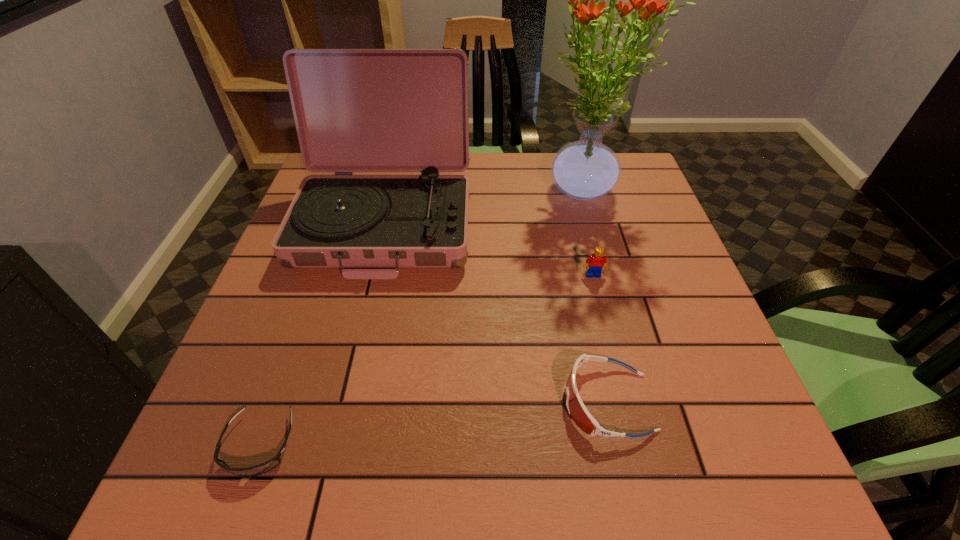
The height and width of the screenshot is (540, 960). In order to click on flower arrangement in this screenshot , I will do `click(584, 170)`.

Locate an element on the screen. record player is located at coordinates (356, 110).

In order to click on Lego in this screenshot , I will do `click(597, 261)`.

At what (x,y) coordinates should I click in order to perform the action: click on the second shortest object. Please return your answer as a coordinate pair (x, y). This screenshot has height=540, width=960. Looking at the image, I should click on (576, 408).

The height and width of the screenshot is (540, 960). Identify the location of the taller goggles. (576, 408).

What are the coordinates of `the shortest object` in the screenshot? It's located at (262, 468).

Locate an element on the screen. the left goggles is located at coordinates (262, 468).

This screenshot has height=540, width=960. In order to click on vacant space located on the left of the tallest object in this screenshot , I will do pos(433,191).

At what (x,y) coordinates should I click in order to perform the action: click on vacant space located 0.230m with the lid open on the fourth shortest object. Please return your answer as a coordinate pair (x, y). This screenshot has height=540, width=960. Looking at the image, I should click on (350, 377).

Find the location of a particular element. This screenshot has height=540, width=960. vacant area situated on the front-facing side of the third tallest object is located at coordinates (631, 426).